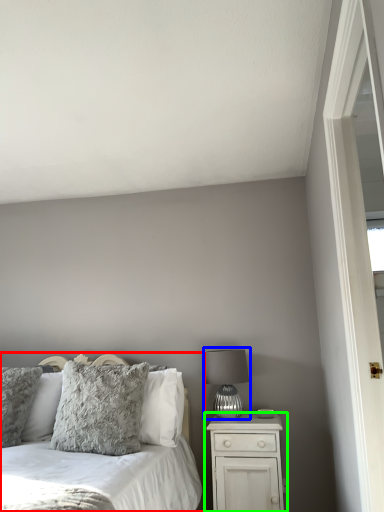
Question: Considering the real-world distances, which object is farthest from bed (highlighted by a red box)? table lamp (highlighted by a blue box) or nightstand (highlighted by a green box)?

Choices:
 (A) table lamp
 (B) nightstand

Answer: (A)